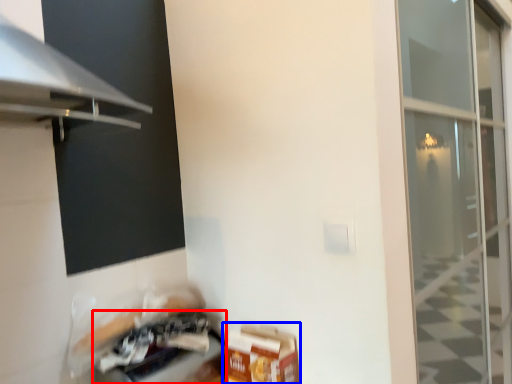
Question: Which of the following is the farthest to the observer, appliance (highlighted by a red box) or cardboard box (highlighted by a blue box)?

Choices:
 (A) appliance
 (B) cardboard box

Answer: (B)